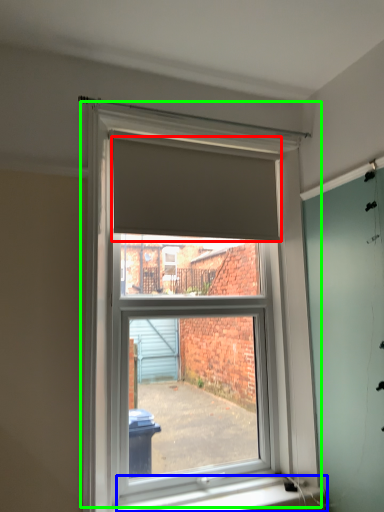
Question: Estimate the real-world distances between objects in this image. Which object is farther from blind (highlighted by a red box), window sill (highlighted by a blue box) or window (highlighted by a green box)?

Choices:
 (A) window sill
 (B) window

Answer: (A)